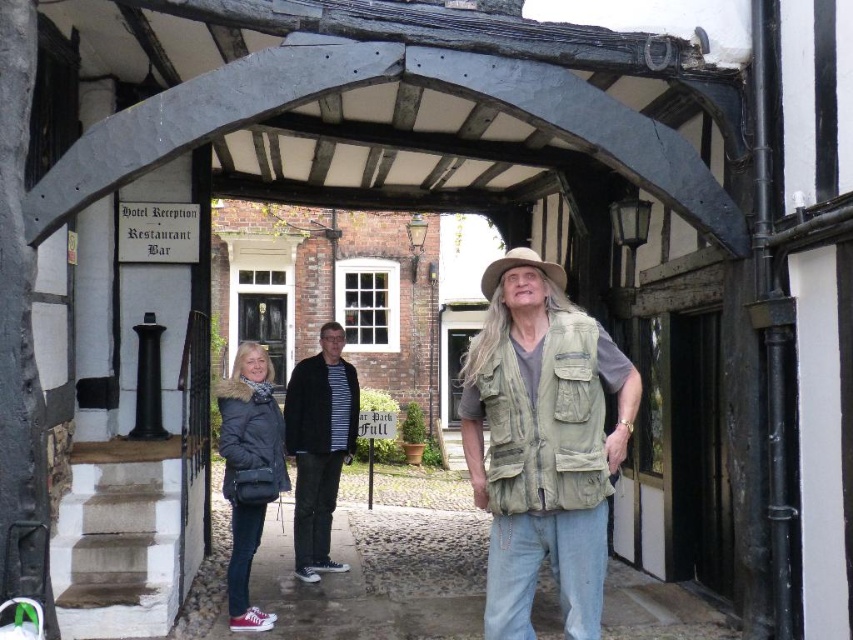
Question: Which of the following is the closest to the observer?

Choices:
 (A) (318, 385)
 (B) (242, 380)
 (C) (500, 259)

Answer: (C)

Question: Does khaki fabric vest at center have a larger size compared to striped cotton shirt at center?

Choices:
 (A) no
 (B) yes

Answer: (A)

Question: Does matte black jacket at lower left have a smaller size compared to beige fabric cowboy hat at center?

Choices:
 (A) no
 (B) yes

Answer: (B)

Question: Which object appears closest to the camera in this image?

Choices:
 (A) khaki fabric vest at center
 (B) matte black jacket at lower left
 (C) beige fabric cowboy hat at center

Answer: (A)

Question: In this image, where is striped cotton shirt at center located relative to matte black jacket at lower left?

Choices:
 (A) above
 (B) below

Answer: (A)

Question: Which point is farther from the camera taking this photo?

Choices:
 (A) (288, 417)
 (B) (537, 260)

Answer: (A)